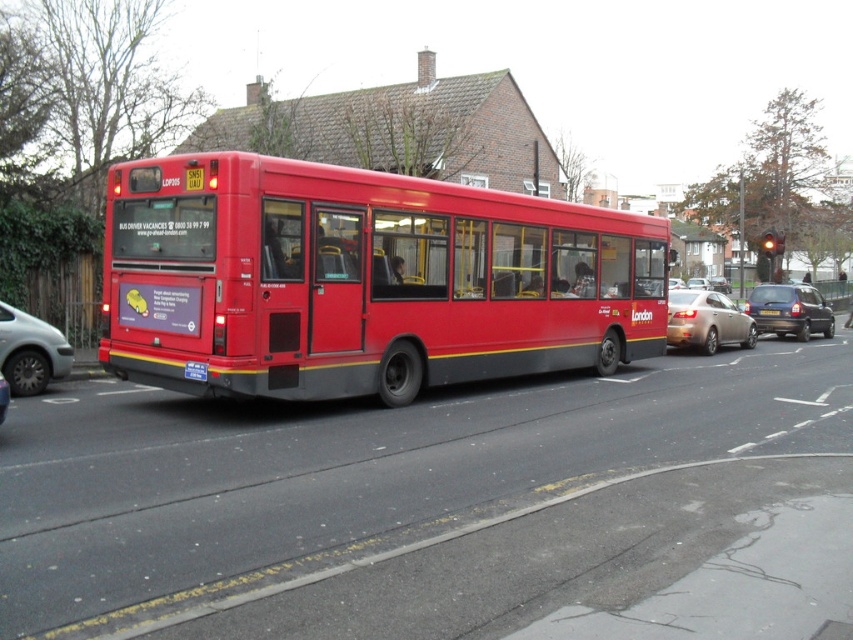
Question: Which point is closer to the camera?

Choices:
 (A) (4, 408)
 (B) (53, 356)
 (C) (773, 316)
 (D) (735, 310)

Answer: (A)

Question: Which of the following is the farthest from the observer?

Choices:
 (A) matte red bus at center
 (B) metallic blue hatchback at right
 (C) black plastic license plate at center
 (D) metallic silver car at center

Answer: (C)

Question: From the image, what is the correct spatial relationship of matte red bus at center in relation to silver metallic van at left?

Choices:
 (A) left
 (B) right

Answer: (B)

Question: Which object is farther from the camera taking this photo?

Choices:
 (A) silver metallic van at left
 (B) matte red bus at center

Answer: (A)

Question: Is matte red bus at center to the left of metallic blue hatchback at right from the viewer's perspective?

Choices:
 (A) no
 (B) yes

Answer: (B)

Question: Where is silver metallic van at left located in relation to metallic silver car at center in the image?

Choices:
 (A) below
 (B) above

Answer: (B)